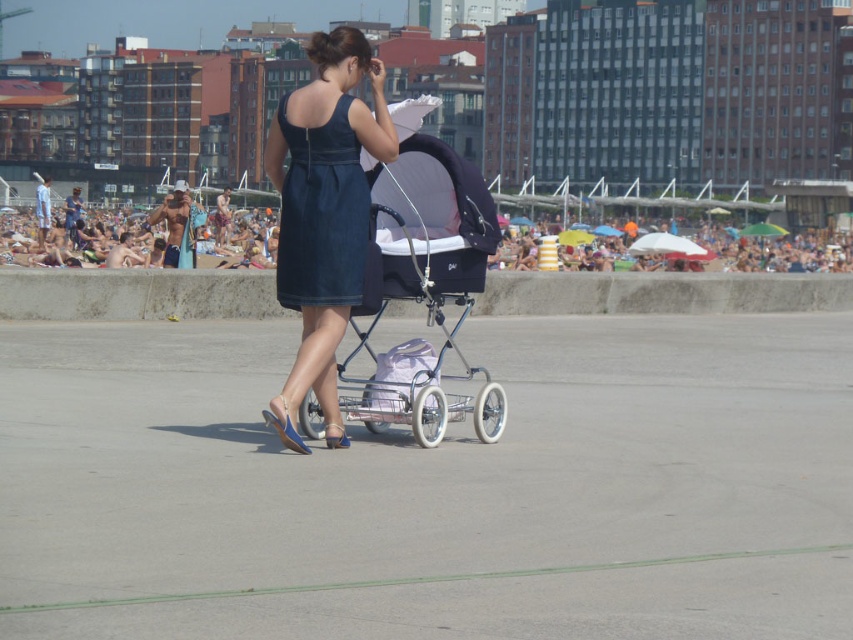
Question: Does dark denim dress at center have a greater width compared to multicolored umbrellas at upper center?

Choices:
 (A) yes
 (B) no

Answer: (B)

Question: From the image, what is the correct spatial relationship of denim dress at center in relation to matte black baby carriage at center?

Choices:
 (A) above
 (B) below

Answer: (A)

Question: Which of the following is the closest to the observer?

Choices:
 (A) (260, 227)
 (B) (364, 266)
 (C) (323, 323)
 (D) (473, 168)

Answer: (C)

Question: Which of these objects is positioned closest to the denim dress at center?

Choices:
 (A) dark denim dress at center
 (B) matte black baby carriage at center

Answer: (A)

Question: Can you confirm if denim dress at center is positioned above matte black baby carriage at center?

Choices:
 (A) no
 (B) yes

Answer: (B)

Question: Which of the following is the closest to the observer?

Choices:
 (A) (328, 362)
 (B) (328, 257)
 (C) (409, 163)

Answer: (B)